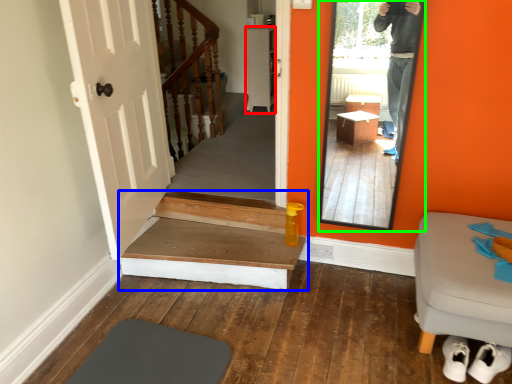
Question: Considering the real-world distances, which object is farthest from cabinetry (highlighted by a red box)? stairs (highlighted by a blue box) or mirror (highlighted by a green box)?

Choices:
 (A) stairs
 (B) mirror

Answer: (A)